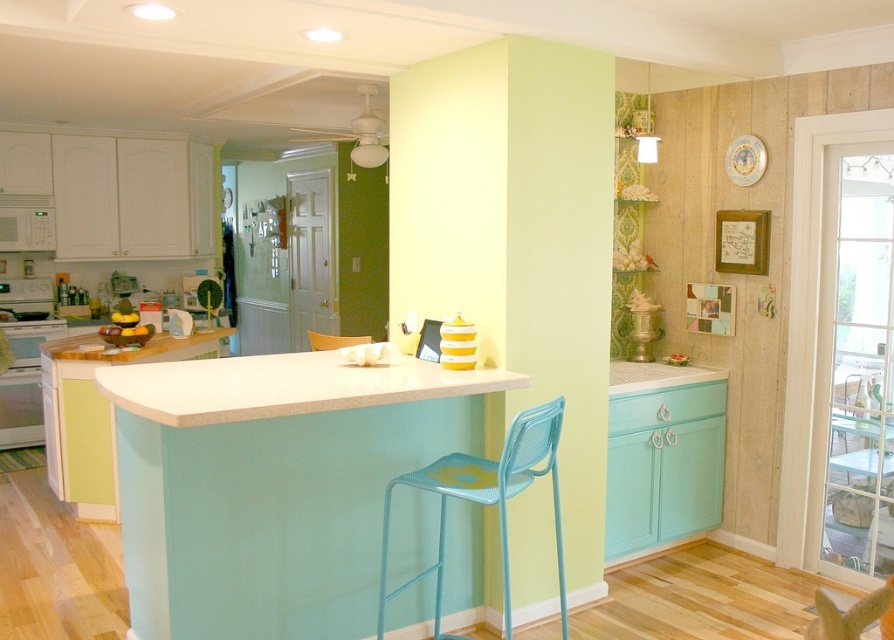
Is light blue mesh stool at center thinner than white glossy oven at left?

In fact, light blue mesh stool at center might be wider than white glossy oven at left.

Can you confirm if light blue mesh stool at center is positioned above white glossy oven at left?

Actually, light blue mesh stool at center is below white glossy oven at left.

Is point (563, 564) in front of point (26, 340)?

Yes, point (563, 564) is closer to viewer.

The image size is (894, 640). I want to click on light blue mesh stool at center, so click(x=486, y=500).

Describe the element at coordinates (273, 484) in the screenshot. This screenshot has width=894, height=640. I see `matte turquoise bar at center` at that location.

Is matte turquoise bar at center to the left of white glossy oven at left from the viewer's perspective?

In fact, matte turquoise bar at center is to the right of white glossy oven at left.

Is point (332, 403) more distant than point (45, 308)?

No.

Identify the location of matte turquoise bar at center. (273, 484).

The image size is (894, 640). What do you see at coordinates (516, 241) in the screenshot?
I see `light yellow smooth pillar at center` at bounding box center [516, 241].

Identify the location of light yellow smooth pillar at center. (516, 241).

At what (x,y) coordinates should I click in order to perform the action: click on light yellow smooth pillar at center. Please return your answer as a coordinate pair (x, y). The image size is (894, 640). Looking at the image, I should click on (516, 241).